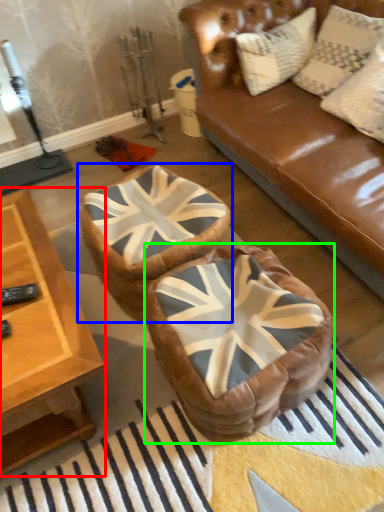
Question: Considering the real-world distances, which object is closest to table (highlighted by a red box)? bean bag chair (highlighted by a blue box) or bean bag chair (highlighted by a green box).

Choices:
 (A) bean bag chair
 (B) bean bag chair

Answer: (A)